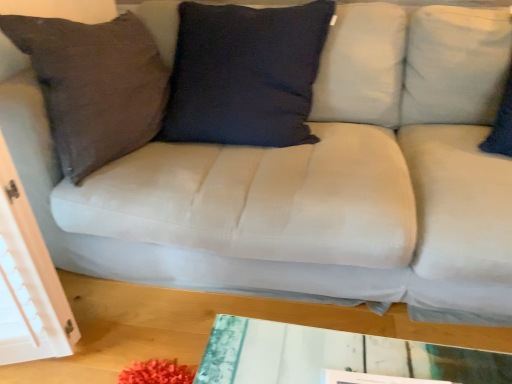
In order to click on suede-like brown pillow at left in this screenshot , I will do `click(94, 85)`.

Describe the element at coordinates (94, 85) in the screenshot. I see `suede-like brown pillow at left` at that location.

The image size is (512, 384). In order to click on suede-like brown pillow at left in this screenshot , I will do `click(94, 85)`.